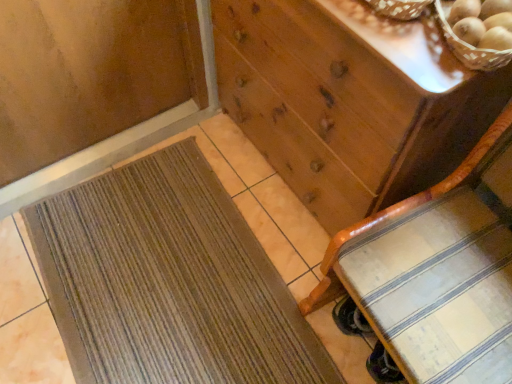
Where is `vacant location below brown textured mat at lower left (from a real-world perspective)`? vacant location below brown textured mat at lower left (from a real-world perspective) is located at coordinates (164, 282).